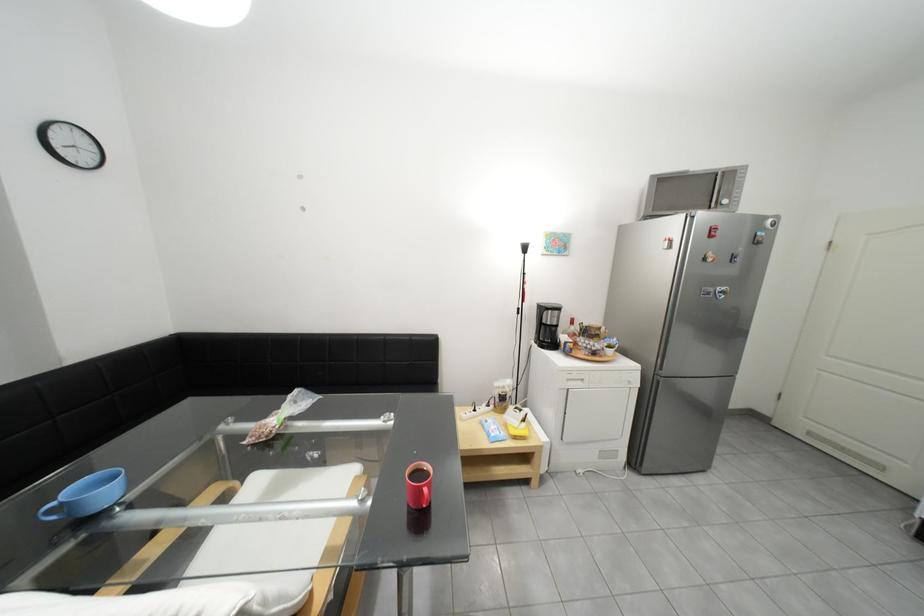
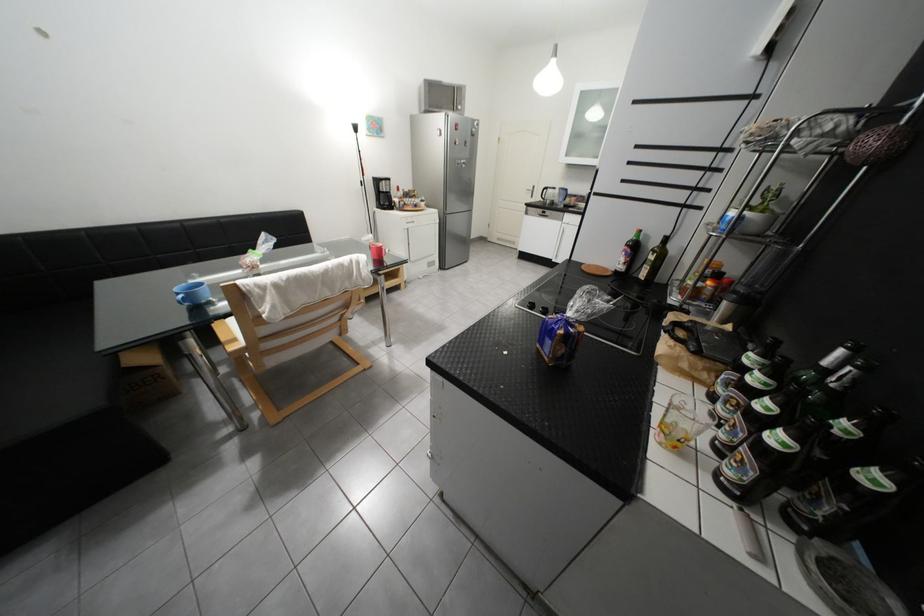
In the second image, find the point that corresponds to pixel 682 227 in the first image.

(451, 121)